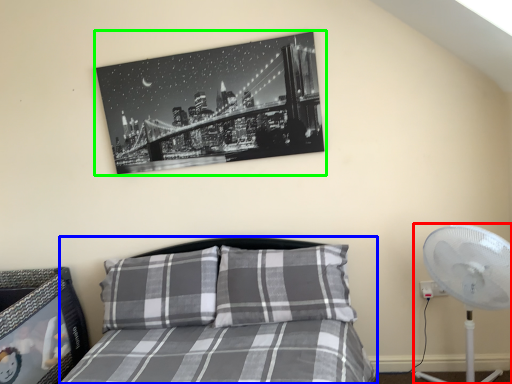
Question: Considering the real-world distances, which object is farthest from mechanical fan (highlighted by a red box)? bed (highlighted by a blue box) or picture frame (highlighted by a green box)?

Choices:
 (A) bed
 (B) picture frame

Answer: (B)